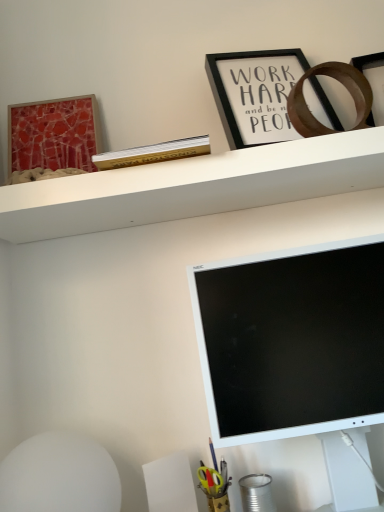
What do you see at coordinates (193, 186) in the screenshot? This screenshot has width=384, height=512. I see `white matte shelf at upper center` at bounding box center [193, 186].

The image size is (384, 512). What do you see at coordinates (54, 134) in the screenshot? I see `matte red picture frame at upper left, acting as the second picture frame starting from the right` at bounding box center [54, 134].

Identify the location of white matte computer monitor at lower right. This screenshot has width=384, height=512. (292, 341).

Where is `stationery in front of the matte red picture frame at upper left, acting as the second picture frame starting from the right`? stationery in front of the matte red picture frame at upper left, acting as the second picture frame starting from the right is located at coordinates (256, 493).

From a real-world perspective, does matte red picture frame at upper left, placed as the 1th picture frame when sorted from left to right, stand above metallic tin can at lower right?

Indeed, from a real-world perspective, matte red picture frame at upper left, placed as the 1th picture frame when sorted from left to right, stands above metallic tin can at lower right.

Consider the image. Is matte red picture frame at upper left, acting as the second picture frame starting from the right, turned away from metallic tin can at lower right?

No.

Is matte red picture frame at upper left, placed as the 1th picture frame when sorted from left to right, at the right side of metallic tin can at lower right?

No, matte red picture frame at upper left, placed as the 1th picture frame when sorted from left to right, is not to the right of metallic tin can at lower right.

Does point (146, 175) appear closer or farther from the camera than point (312, 409)?

Point (146, 175) appears to be farther away from the viewer than point (312, 409).

From a real-world perspective, is white matte shelf at upper center physically located above or below white matte computer monitor at lower right?

In terms of real-world spatial position, white matte shelf at upper center is above white matte computer monitor at lower right.

From the image's perspective, is white matte shelf at upper center beneath white matte computer monitor at lower right?

No, from the image's perspective, white matte shelf at upper center is not below white matte computer monitor at lower right.

Which is behind, white matte shelf at upper center or white matte computer monitor at lower right?

white matte shelf at upper center.

In the scene shown: Is metallic tin can at lower right positioned far away from matte red picture frame at upper left, placed as the 1th picture frame when sorted from left to right?

No.

Is metallic tin can at lower right taller than matte red picture frame at upper left, placed as the 1th picture frame when sorted from left to right?

No, metallic tin can at lower right is not taller than matte red picture frame at upper left, placed as the 1th picture frame when sorted from left to right.

Is the depth of metallic tin can at lower right greater than that of matte red picture frame at upper left, placed as the 1th picture frame when sorted from left to right?

No, metallic tin can at lower right is closer to the camera.

Is metallic tin can at lower right positioned with its back to matte red picture frame at upper left, acting as the second picture frame starting from the right?

No, metallic tin can at lower right is not facing the opposite direction of matte red picture frame at upper left, acting as the second picture frame starting from the right.

Is metallic tin can at lower right smaller than black matte picture frame at upper center, the first picture frame when ordered from right to left?

Yes.

Consider the image. Is metallic tin can at lower right positioned far away from black matte picture frame at upper center, the first picture frame when ordered from right to left?

That's not correct — metallic tin can at lower right is a little close to black matte picture frame at upper center, the first picture frame when ordered from right to left.

Is metallic tin can at lower right to the right of black matte picture frame at upper center, the first picture frame when ordered from right to left, from the viewer's perspective?

In fact, metallic tin can at lower right is to the left of black matte picture frame at upper center, the first picture frame when ordered from right to left.

Would you say metallic tin can at lower right is inside or outside black matte picture frame at upper center, the first picture frame when ordered from right to left?

metallic tin can at lower right is outside black matte picture frame at upper center, the first picture frame when ordered from right to left.

Measure the distance from white matte shelf at upper center to metallic tin can at lower right.

A distance of 24.82 inches exists between white matte shelf at upper center and metallic tin can at lower right.

Can you confirm if white matte shelf at upper center is smaller than metallic tin can at lower right?

Incorrect, white matte shelf at upper center is not smaller in size than metallic tin can at lower right.

Is white matte shelf at upper center facing towards metallic tin can at lower right?

No.

Does point (283, 202) lie in front of point (260, 509)?

No.

Considering the relative positions of white matte computer monitor at lower right and matte red picture frame at upper left, acting as the second picture frame starting from the right, in the image provided, is white matte computer monitor at lower right to the left of matte red picture frame at upper left, acting as the second picture frame starting from the right, from the viewer's perspective?

No.

In terms of width, does white matte computer monitor at lower right look wider or thinner when compared to matte red picture frame at upper left, acting as the second picture frame starting from the right?

white matte computer monitor at lower right is wider than matte red picture frame at upper left, acting as the second picture frame starting from the right.

Between white matte computer monitor at lower right and matte red picture frame at upper left, placed as the 1th picture frame when sorted from left to right, which one has larger size?

white matte computer monitor at lower right.

Are white matte computer monitor at lower right and matte red picture frame at upper left, placed as the 1th picture frame when sorted from left to right, far apart?

No, white matte computer monitor at lower right is not far away from matte red picture frame at upper left, placed as the 1th picture frame when sorted from left to right.

From a real-world perspective, which object stands above the other?

white matte computer monitor at lower right is physically above.

How different are the orientations of metallic tin can at lower right and white matte computer monitor at lower right in degrees?

The angular difference between metallic tin can at lower right and white matte computer monitor at lower right is 3.37 degrees.

Can you confirm if metallic tin can at lower right is wider than white matte computer monitor at lower right?

No.

Which of these two, metallic tin can at lower right or white matte computer monitor at lower right, is bigger?

white matte computer monitor at lower right.

Locate an element on the screen. stationery below the matte red picture frame at upper left, placed as the 1th picture frame when sorted from left to right (from the image's perspective) is located at coordinates (256, 493).

Find the location of `computer monitor on the right of white matte shelf at upper center`. computer monitor on the right of white matte shelf at upper center is located at coordinates (292, 341).

Looking at the image, which one is located further to black matte picture frame at upper center, placed as the second picture frame when sorted from left to right, white matte computer monitor at lower right or metallic tin can at lower right?

metallic tin can at lower right is further to black matte picture frame at upper center, placed as the second picture frame when sorted from left to right.

Looking at the image, which one is located closer to white matte shelf at upper center, metallic tin can at lower right or white matte computer monitor at lower right?

white matte computer monitor at lower right lies closer to white matte shelf at upper center than the other object.

Based on their spatial positions, is matte red picture frame at upper left, placed as the 1th picture frame when sorted from left to right, or metallic tin can at lower right closer to white matte computer monitor at lower right?

metallic tin can at lower right lies closer to white matte computer monitor at lower right than the other object.

Considering their positions, is white matte shelf at upper center positioned closer to black matte picture frame at upper center, placed as the second picture frame when sorted from left to right, than metallic tin can at lower right?

white matte shelf at upper center lies closer to black matte picture frame at upper center, placed as the second picture frame when sorted from left to right, than the other object.

Estimate the real-world distances between objects in this image. Which object is further from white matte computer monitor at lower right, metallic tin can at lower right or white matte shelf at upper center?

metallic tin can at lower right is positioned further to the anchor white matte computer monitor at lower right.

From the image, which object appears to be farther from matte red picture frame at upper left, acting as the second picture frame starting from the right, white matte computer monitor at lower right or black matte picture frame at upper center, the first picture frame when ordered from right to left?

white matte computer monitor at lower right is further to matte red picture frame at upper left, acting as the second picture frame starting from the right.

When comparing their distances from white matte computer monitor at lower right, does matte red picture frame at upper left, acting as the second picture frame starting from the right, or white matte shelf at upper center seem closer?

white matte shelf at upper center.

Consider the image. Which object lies further to the anchor point metallic tin can at lower right, matte red picture frame at upper left, acting as the second picture frame starting from the right, or white matte computer monitor at lower right?

matte red picture frame at upper left, acting as the second picture frame starting from the right.

The height and width of the screenshot is (512, 384). Identify the location of shelf that lies between black matte picture frame at upper center, the first picture frame when ordered from right to left, and white matte computer monitor at lower right from top to bottom. click(193, 186).

The height and width of the screenshot is (512, 384). Find the location of `picture frame between black matte picture frame at upper center, placed as the second picture frame when sorted from left to right, and white matte computer monitor at lower right from top to bottom`. picture frame between black matte picture frame at upper center, placed as the second picture frame when sorted from left to right, and white matte computer monitor at lower right from top to bottom is located at coordinates (54, 134).

This screenshot has height=512, width=384. In order to click on shelf between matte red picture frame at upper left, placed as the 1th picture frame when sorted from left to right, and black matte picture frame at upper center, the first picture frame when ordered from right to left, in the horizontal direction in this screenshot , I will do `click(193, 186)`.

At what (x,y) coordinates should I click in order to perform the action: click on computer monitor between black matte picture frame at upper center, placed as the second picture frame when sorted from left to right, and metallic tin can at lower right in the up-down direction. Please return your answer as a coordinate pair (x, y). Looking at the image, I should click on (292, 341).